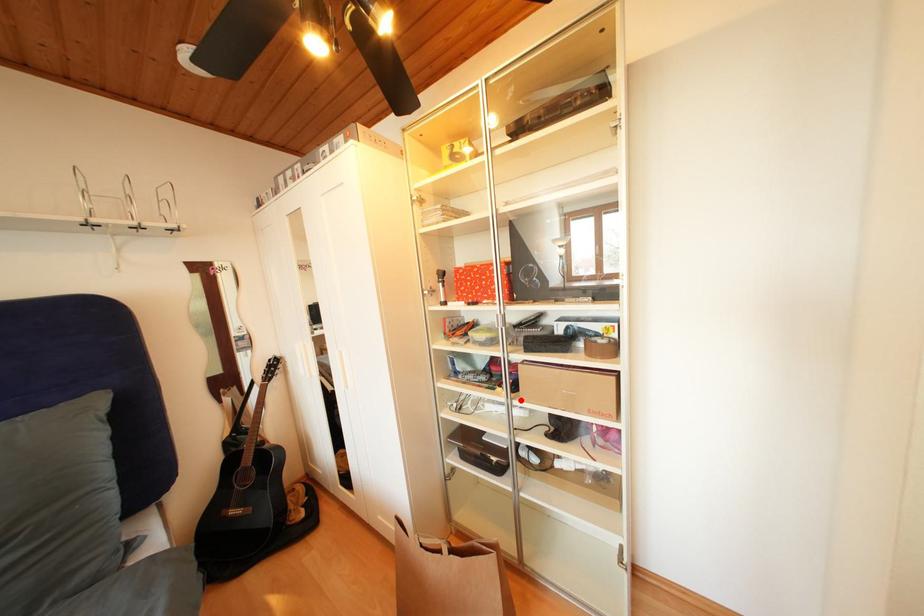
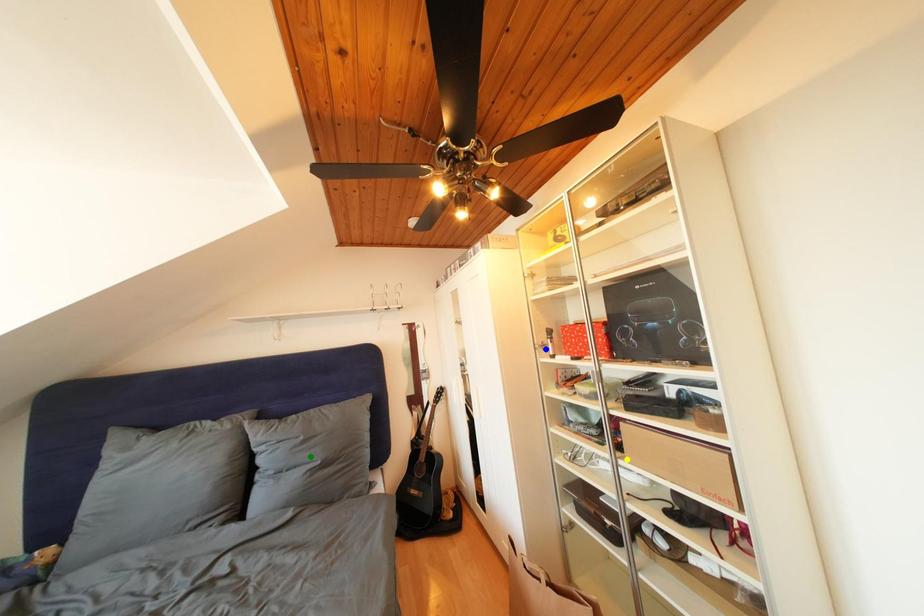
Question: I am providing you with two images of the same scene from different viewpoints. A red point is marked on the first image. You are given multiple points on the second image. Which point in image 2 represents the same 3d spot as the red point in image 1?

Choices:
 (A) blue point
 (B) yellow point
 (C) green point

Answer: (B)